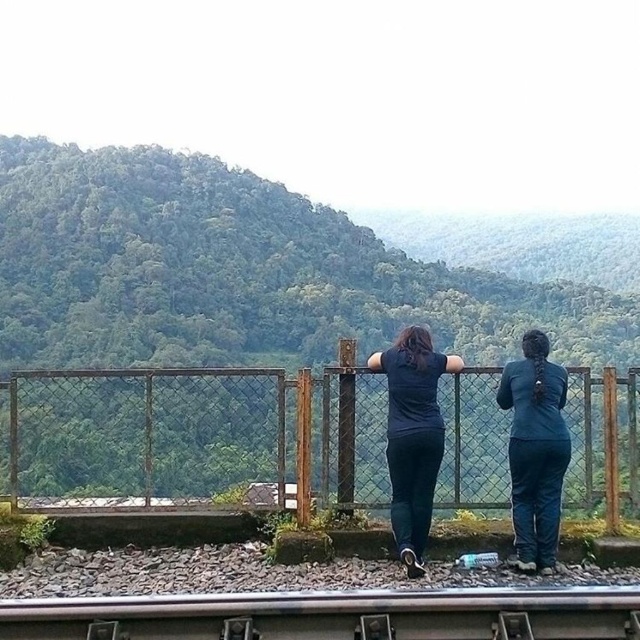
Question: Does rusty metal fence at center appear on the right side of dark blue shirt at center?

Choices:
 (A) no
 (B) yes

Answer: (A)

Question: Is green leafy forest at upper center to the left of teal fabric pants at right from the viewer's perspective?

Choices:
 (A) no
 (B) yes

Answer: (B)

Question: Among these points, which one is nearest to the camera?

Choices:
 (A) (529, 432)
 (B) (515, 324)
 (C) (147, 605)
 (D) (406, 573)

Answer: (C)

Question: Among these objects, which one is nearest to the camera?

Choices:
 (A) teal fabric pants at right
 (B) dark blue shirt at center
 (C) rusty metal fence at center
 (D) green leafy forest at upper center

Answer: (B)

Question: Can you confirm if teal fabric pants at right is positioned to the left of dark blue shirt at center?

Choices:
 (A) yes
 (B) no

Answer: (B)

Question: Which of these objects is positioned farthest from the teal fabric pants at right?

Choices:
 (A) smooth metal train track at lower center
 (B) green leafy forest at upper center
 (C) rusty metal fence at center

Answer: (B)